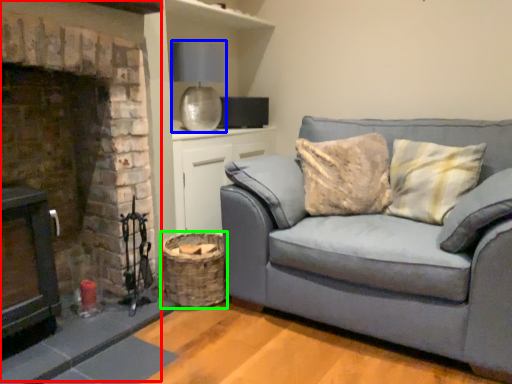
Question: Which is farther away from fireplace (highlighted by a red box)? lamp (highlighted by a blue box) or basket (highlighted by a green box)?

Choices:
 (A) lamp
 (B) basket

Answer: (A)